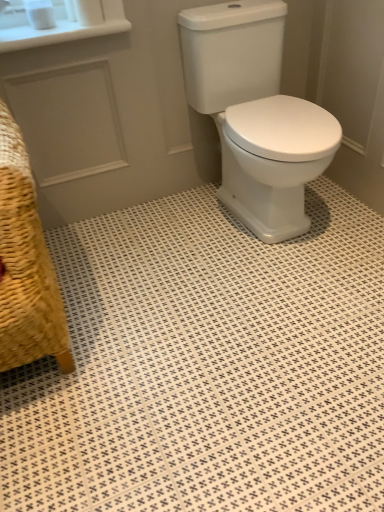
Question: Considering the relative positions of white glossy ceramic tile at center and woven straw armchair at lower left in the image provided, is white glossy ceramic tile at center to the left or to the right of woven straw armchair at lower left?

Choices:
 (A) left
 (B) right

Answer: (B)

Question: From the image's perspective, is white glossy ceramic tile at center located above or below woven straw armchair at lower left?

Choices:
 (A) above
 (B) below

Answer: (B)

Question: Estimate the real-world distances between objects in this image. Which object is farther from the white glossy ceramic tile at center?

Choices:
 (A) white matte toilet paper at upper left, which is the 2th toilet paper in left-to-right order
 (B) white glossy porcelain at center
 (C) white matte toilet paper at upper left, the 2th toilet paper from the right
 (D) woven straw armchair at lower left

Answer: (C)

Question: Estimate the real-world distances between objects in this image. Which object is closer to the white matte toilet paper at upper left, which is the 2th toilet paper in left-to-right order?

Choices:
 (A) white glossy porcelain at center
 (B) white glossy ceramic tile at center
 (C) white matte toilet paper at upper left, which is the first toilet paper in left-to-right order
 (D) woven straw armchair at lower left

Answer: (C)